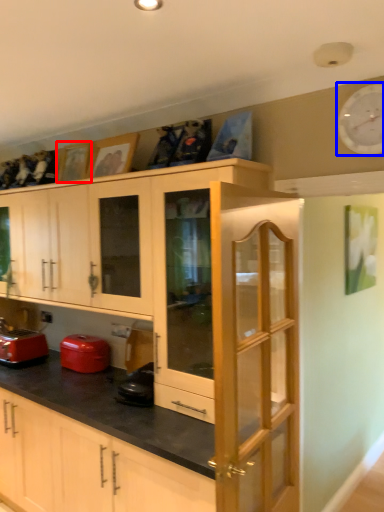
Question: Which of the following is the closest to the observer, picture frame (highlighted by a red box) or clock (highlighted by a blue box)?

Choices:
 (A) picture frame
 (B) clock

Answer: (B)